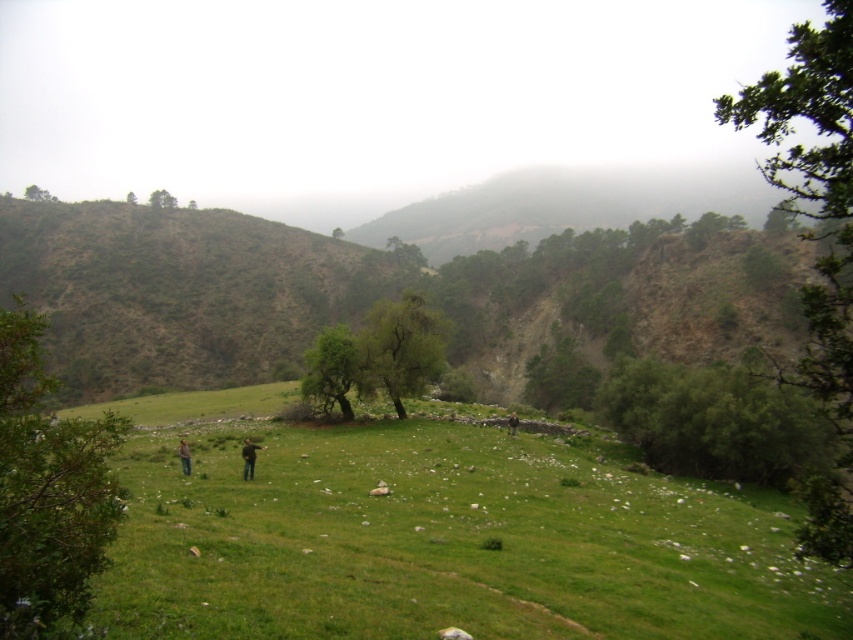
You are standing at the center of the grassy field in the image. Which direction should you walk to reach the green leafy tree at right?

The green leafy tree at right is located at coordinates point (816, 241), so you should walk towards the right side of the image to reach it.

You are standing at the origin point in the center of the image. You see two points marked in the scene. Which point is closer to you, the point at coordinates [851,141] or the point at [131,189]?

Point [851,141] is in front of point [131,189], so the point at [851,141] is closer to you.